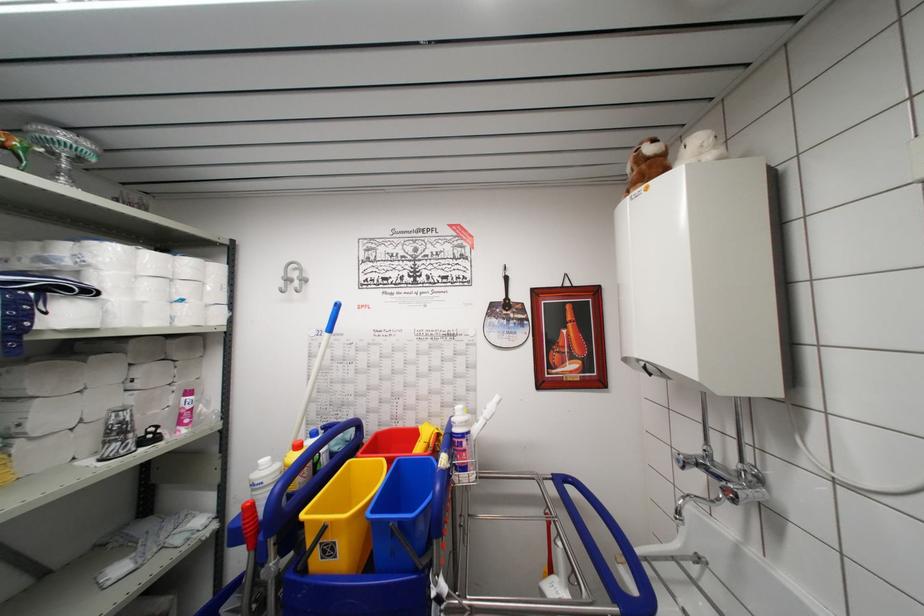
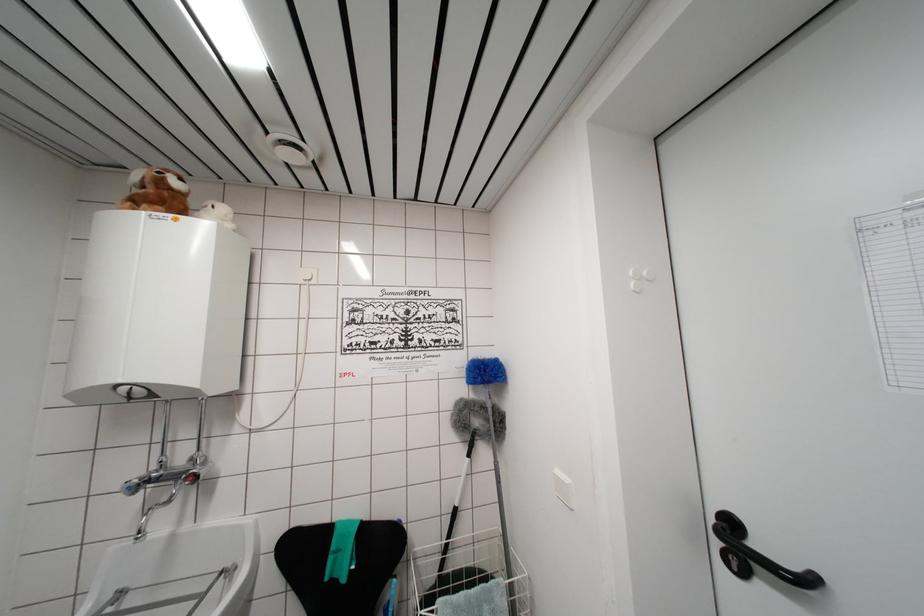
Locate, in the second image, the point that corresponds to point 682,464 in the first image.

(132, 493)